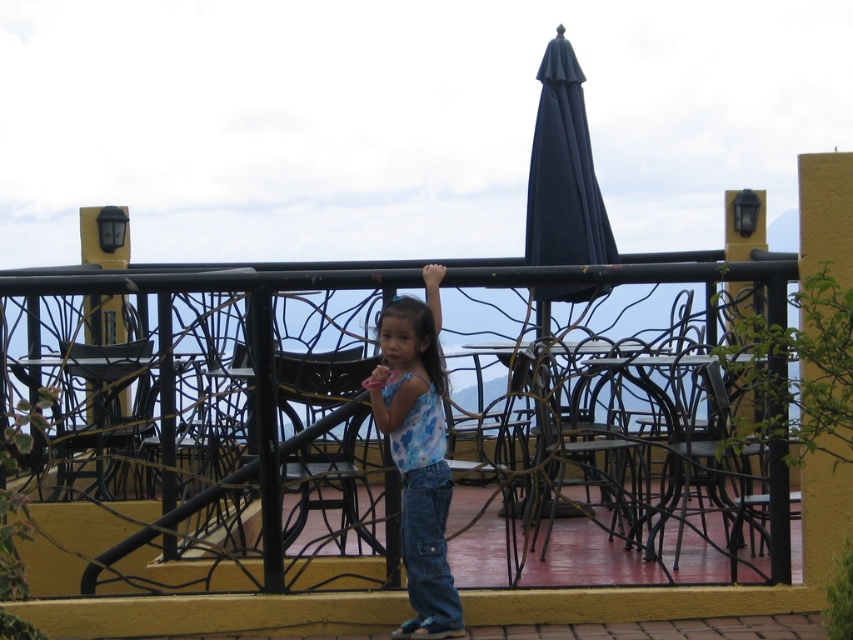
Who is more distant from viewer, (x=88, y=570) or (x=428, y=285)?

The point (x=88, y=570) is behind.

Is black wrought iron fence at center in front of light skin hand at upper center?

That is True.

Identify the location of black wrought iron fence at center. The width and height of the screenshot is (853, 640). (216, 413).

Where is `black wrought iron fence at center`? This screenshot has width=853, height=640. black wrought iron fence at center is located at coordinates (216, 413).

Which is in front, point (293, 388) or point (379, 320)?

Point (379, 320) is in front.

Is point (39, 289) positioned behind point (408, 536)?

Yes, point (39, 289) is behind point (408, 536).

The image size is (853, 640). I want to click on black wrought iron fence at center, so click(x=216, y=413).

Is point (381, 381) behind point (428, 278)?

No, it is in front of (428, 278).

Which is in front, point (393, 378) or point (438, 262)?

Point (393, 378) is more forward.

The width and height of the screenshot is (853, 640). What do you see at coordinates (378, 378) in the screenshot?
I see `matte skin hand at center` at bounding box center [378, 378].

Where is `matte skin hand at center`? The width and height of the screenshot is (853, 640). matte skin hand at center is located at coordinates (378, 378).